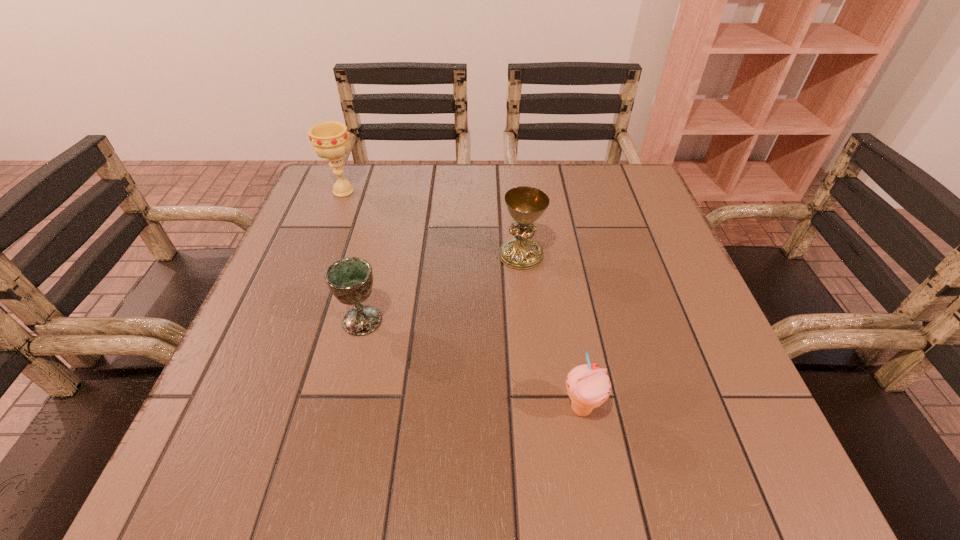
Identify the location of free location at the near left corner of the desktop. (274, 472).

Locate an element on the screen. free spot at the far right corner of the desktop is located at coordinates (595, 199).

At what (x,y) coordinates should I click in order to perform the action: click on empty location between the leftmost object and the nearest object. Please return your answer as a coordinate pair (x, y). The height and width of the screenshot is (540, 960). Looking at the image, I should click on (463, 300).

This screenshot has height=540, width=960. I want to click on vacant area that lies between the leftmost object and the nearest chalice, so coord(353,256).

The height and width of the screenshot is (540, 960). I want to click on free point between the second farthest object and the icecream, so click(551, 332).

I want to click on vacant region between the nearest object and the rightmost chalice, so click(551, 332).

Locate an element on the screen. free space between the second nearest object and the farthest chalice is located at coordinates (353, 256).

Identify the location of free space between the leftmost chalice and the second nearest chalice. The image size is (960, 540). (432, 223).

Locate an element on the screen. The image size is (960, 540). empty space between the second chalice from right to left and the nearest object is located at coordinates (471, 365).

The image size is (960, 540). What are the coordinates of `empty space between the shortest chalice and the third nearest object` in the screenshot? It's located at (442, 288).